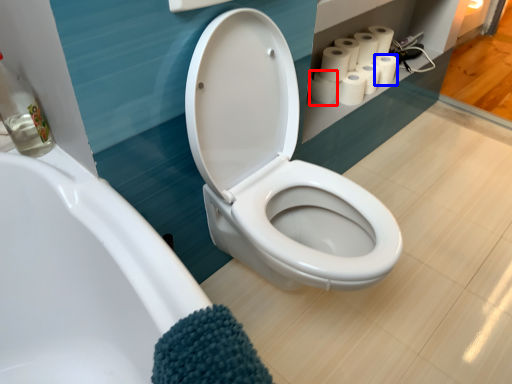
Question: Which object appears closest to the camera in this image, toilet paper (highlighted by a red box) or toilet paper (highlighted by a blue box)?

Choices:
 (A) toilet paper
 (B) toilet paper

Answer: (A)